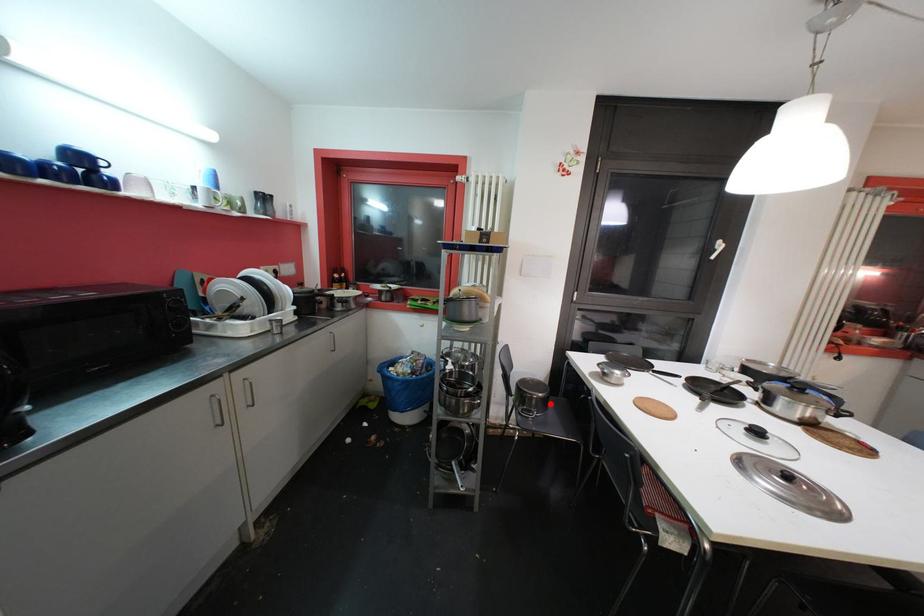
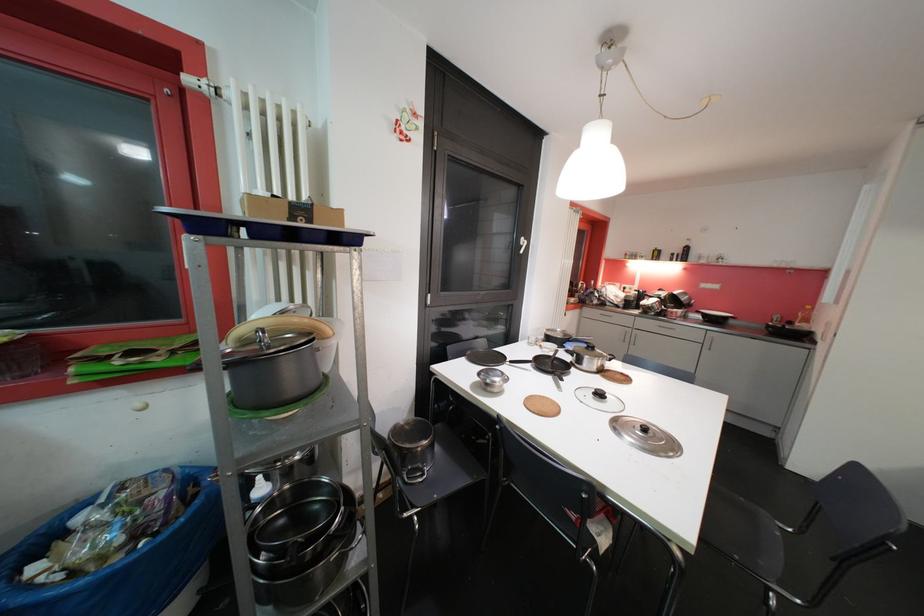
The point at the highlighted location is marked in the first image. Where is the corresponding point in the second image?

(436, 447)